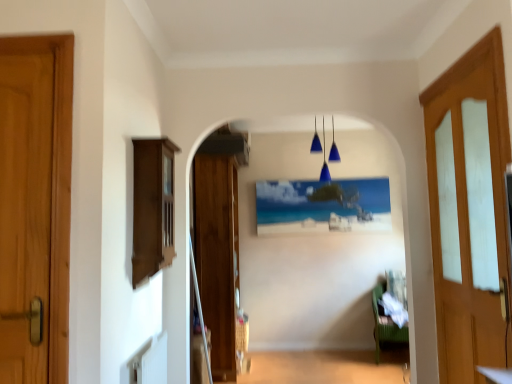
This screenshot has height=384, width=512. Find the location of `vacant area situated below green fabric couch at lower right (from a real-world perspective)`. vacant area situated below green fabric couch at lower right (from a real-world perspective) is located at coordinates (394, 357).